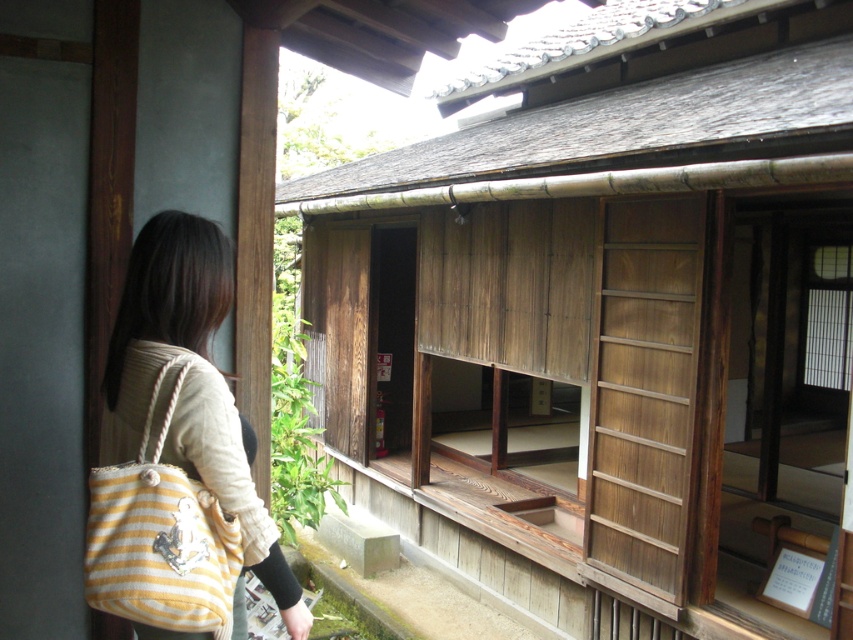
In the scene shown: Can you confirm if wooden sliding door at center is bigger than yellow striped fabric shoulder bag at left?

No, wooden sliding door at center is not bigger than yellow striped fabric shoulder bag at left.

Does point (534, 497) come behind point (160, 618)?

Yes, point (534, 497) is behind point (160, 618).

This screenshot has width=853, height=640. What are the coordinates of `wooden sliding door at center` in the screenshot? It's located at (607, 320).

Does yellow striped fabric bag at left have a smaller size compared to yellow striped fabric shoulder bag at left?

Actually, yellow striped fabric bag at left might be larger than yellow striped fabric shoulder bag at left.

Is yellow striped fabric bag at left positioned behind yellow striped fabric shoulder bag at left?

That is True.

Which is in front, point (216, 301) or point (120, 573)?

Point (120, 573)

The image size is (853, 640). I want to click on yellow striped fabric bag at left, so click(190, 385).

Is wooden sliding door at center below yellow striped fabric bag at left?

Yes.

Which is behind, point (685, 572) or point (207, 365)?

The point (685, 572) is more distant.

The height and width of the screenshot is (640, 853). I want to click on wooden sliding door at center, so click(607, 320).